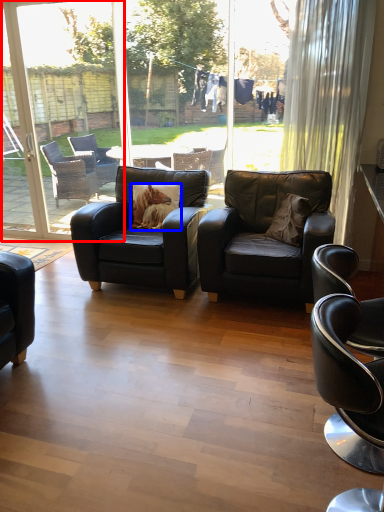
Question: Which object appears farthest to the camera in this image, screen door (highlighted by a red box) or pillow (highlighted by a blue box)?

Choices:
 (A) screen door
 (B) pillow

Answer: (A)